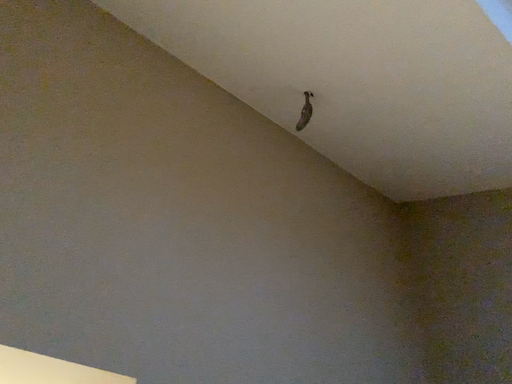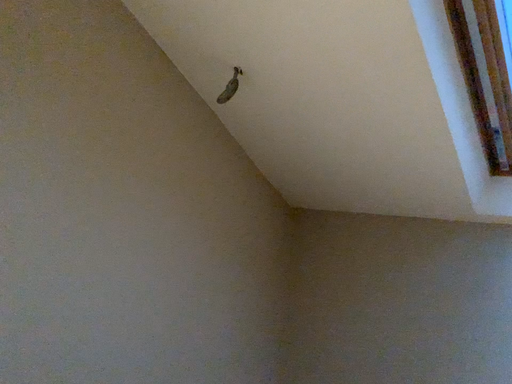
Question: Which way did the camera rotate in the video?

Choices:
 (A) rotated left
 (B) rotated right

Answer: (B)